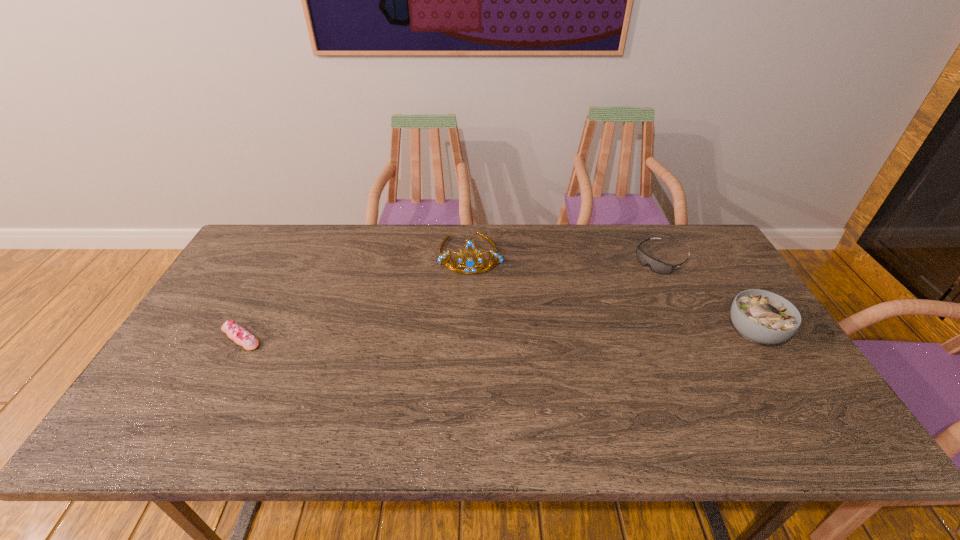
You are a GUI agent. You are given a task and a screenshot of the screen. Output one action in this format:
    pyautogui.click(x=<x>, y=<y>)
    Task: Click on the shortest object
    This screenshot has height=540, width=960.
    Given the screenshot: What is the action you would take?
    [x=242, y=337]

I want to click on eclair, so click(242, 337).

Image resolution: width=960 pixels, height=540 pixels. Find the location of `soup bowl`. soup bowl is located at coordinates click(x=760, y=316).

This screenshot has width=960, height=540. Find the location of `tiara`. tiara is located at coordinates (470, 264).

At what (x,y) coordinates should I click in order to perform the action: click on the tallest object. Please return your answer as a coordinate pair (x, y). The width and height of the screenshot is (960, 540). Looking at the image, I should click on (470, 264).

The image size is (960, 540). I want to click on goggles, so click(656, 266).

Identify the location of free space located 0.260m on the right of the eclair. (362, 337).

This screenshot has width=960, height=540. I want to click on free location located 0.160m on the left of the second tallest object, so click(x=666, y=332).

Find the location of a particular element. vacant space located 0.050m on the front-facing side of the tallest object is located at coordinates (470, 287).

Locate an element on the screen. This screenshot has height=540, width=960. free space located on the front-facing side of the tallest object is located at coordinates coord(470,348).